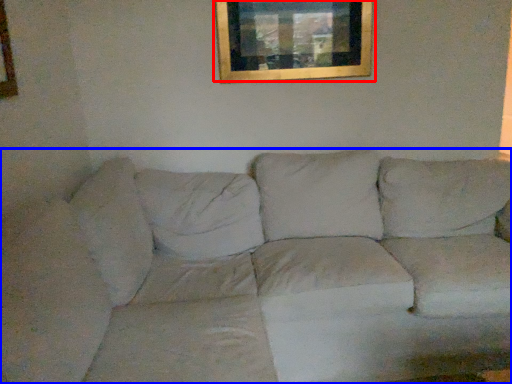
Question: Which of the following is the farthest to the observer, picture frame (highlighted by a red box) or studio couch (highlighted by a blue box)?

Choices:
 (A) picture frame
 (B) studio couch

Answer: (A)